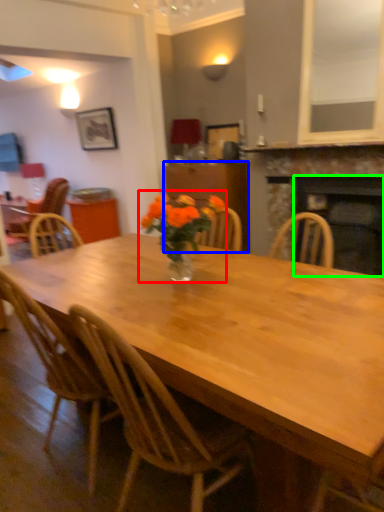
Question: Which object is the farthest from floral arrangement (highlighted by a red box)? Choose among these: cabinetry (highlighted by a blue box) or fireplace (highlighted by a green box).

Choices:
 (A) cabinetry
 (B) fireplace

Answer: (A)